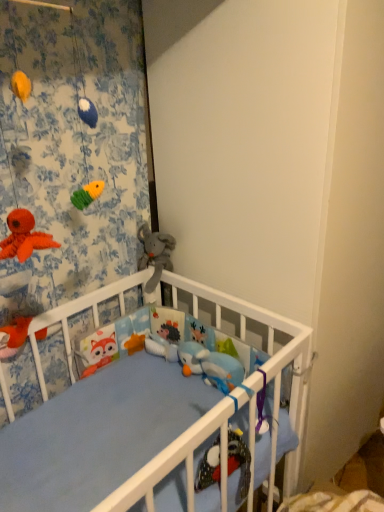
Question: Is floral fabric curtain at upper left outside of soft gray plush elephant at center, which appears as the 1th toy when viewed from the right?

Choices:
 (A) no
 (B) yes

Answer: (B)

Question: From the image's perspective, is floral fabric curtain at upper left located above soft gray plush elephant at center, the first toy when ordered from back to front?

Choices:
 (A) no
 (B) yes

Answer: (B)

Question: Could you tell me if floral fabric curtain at upper left is facing soft gray plush elephant at center, which is counted as the 2th toy, starting from the left?

Choices:
 (A) yes
 (B) no

Answer: (A)

Question: From a real-world perspective, is floral fabric curtain at upper left over soft gray plush elephant at center, which appears as the 1th toy when viewed from the right?

Choices:
 (A) yes
 (B) no

Answer: (A)

Question: Considering the relative sizes of floral fabric curtain at upper left and soft gray plush elephant at center, which is counted as the 2th toy, starting from the left, in the image provided, is floral fabric curtain at upper left shorter than soft gray plush elephant at center, which is counted as the 2th toy, starting from the left,?

Choices:
 (A) yes
 (B) no

Answer: (B)

Question: Is point (170, 238) closer or farther from the camera than point (21, 320)?

Choices:
 (A) closer
 (B) farther

Answer: (B)

Question: In the image, is soft gray plush elephant at center, which is counted as the 2th toy, starting from the left, positioned in front of or behind matte orange plush toy at lower left, which is the first toy in left-to-right order?

Choices:
 (A) front
 (B) behind

Answer: (B)

Question: From the image's perspective, is soft gray plush elephant at center, the first toy when ordered from back to front, positioned above or below matte orange plush toy at lower left, which is the first toy in left-to-right order?

Choices:
 (A) below
 (B) above

Answer: (B)

Question: Is soft gray plush elephant at center, the second toy in the front-to-back sequence, inside the boundaries of matte orange plush toy at lower left, which appears as the second toy when viewed from the right, or outside?

Choices:
 (A) inside
 (B) outside

Answer: (B)

Question: From a real-world perspective, is matte orange plush toy at lower left, the first toy from the front, positioned above or below soft gray plush elephant at center, which ranks as the second toy in bottom-to-top order?

Choices:
 (A) below
 (B) above

Answer: (A)

Question: From the image's perspective, is matte orange plush toy at lower left, which is the first toy in left-to-right order, above or below soft gray plush elephant at center, which ranks as the second toy in bottom-to-top order?

Choices:
 (A) below
 (B) above

Answer: (A)

Question: Based on their positions, is matte orange plush toy at lower left, acting as the second toy starting from the top, located to the left or right of soft gray plush elephant at center, the first toy when ordered from top to bottom?

Choices:
 (A) right
 (B) left

Answer: (B)

Question: From their relative heights in the image, would you say matte orange plush toy at lower left, which appears as the second toy when viewed from the right, is taller or shorter than soft gray plush elephant at center, which appears as the 1th toy when viewed from the right?

Choices:
 (A) short
 (B) tall

Answer: (A)

Question: In the image, is floral fabric curtain at upper left positioned in front of or behind matte orange plush toy at lower left, which appears as the second toy when viewed from the right?

Choices:
 (A) behind
 (B) front

Answer: (B)

Question: From a real-world perspective, relative to matte orange plush toy at lower left, which is the first toy in left-to-right order, is floral fabric curtain at upper left vertically above or below?

Choices:
 (A) below
 (B) above

Answer: (B)